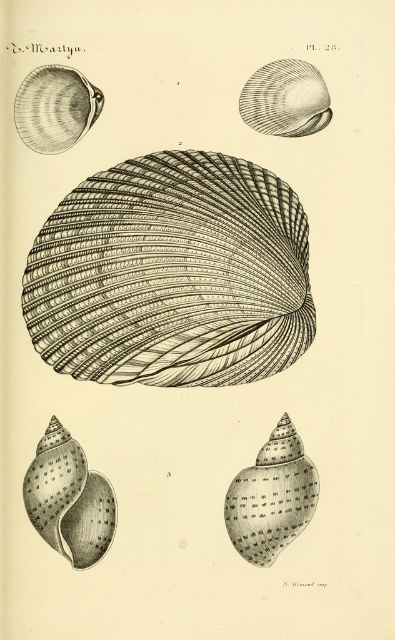
Does smooth gray shell at lower left have a lesser height compared to smooth gray shell at upper right?

No.

Is smooth gray shell at lower left thinner than smooth gray shell at upper right?

Indeed, smooth gray shell at lower left has a lesser width compared to smooth gray shell at upper right.

This screenshot has height=640, width=395. Identify the location of smooth gray shell at lower left. (69, 499).

Find the location of a particular element. The width and height of the screenshot is (395, 640). smooth gray shell at lower left is located at coordinates (69, 499).

Does smooth brown shell at upper left have a larger size compared to smooth gray shell at upper right?

Yes, smooth brown shell at upper left is bigger than smooth gray shell at upper right.

Is smooth brown shell at upper left smaller than smooth gray shell at upper right?

Incorrect, smooth brown shell at upper left is not smaller in size than smooth gray shell at upper right.

Describe the element at coordinates (54, 108) in the screenshot. I see `smooth brown shell at upper left` at that location.

This screenshot has width=395, height=640. I want to click on smooth brown shell at upper left, so click(54, 108).

Between black line drawing shell at center and smooth gray shell at lower left, which one is positioned lower?

Positioned lower is smooth gray shell at lower left.

The height and width of the screenshot is (640, 395). Identify the location of black line drawing shell at center. (171, 275).